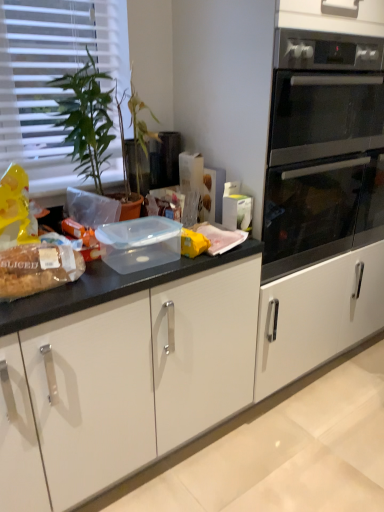
Question: Is translucent plastic bread at left not within green glossy plant at left?

Choices:
 (A) yes
 (B) no

Answer: (A)

Question: From a real-world perspective, is translucent plastic bread at left over green glossy plant at left?

Choices:
 (A) yes
 (B) no

Answer: (B)

Question: From the image's perspective, is translucent plastic bread at left above green glossy plant at left?

Choices:
 (A) yes
 (B) no

Answer: (B)

Question: Does translucent plastic bread at left have a greater width compared to green glossy plant at left?

Choices:
 (A) yes
 (B) no

Answer: (B)

Question: Is translucent plastic bread at left positioned behind green glossy plant at left?

Choices:
 (A) yes
 (B) no

Answer: (B)

Question: Is translucent plastic bread at left bigger than green glossy plant at left?

Choices:
 (A) yes
 (B) no

Answer: (B)

Question: Is translucent plastic bread at left located outside white plastic blinds at upper left?

Choices:
 (A) yes
 (B) no

Answer: (A)

Question: Is translucent plastic bread at left positioned far away from white plastic blinds at upper left?

Choices:
 (A) yes
 (B) no

Answer: (B)

Question: Considering the relative positions of translucent plastic bread at left and white plastic blinds at upper left in the image provided, is translucent plastic bread at left to the right of white plastic blinds at upper left from the viewer's perspective?

Choices:
 (A) no
 (B) yes

Answer: (B)

Question: From a real-world perspective, is translucent plastic bread at left physically below white plastic blinds at upper left?

Choices:
 (A) no
 (B) yes

Answer: (B)

Question: From the image's perspective, is translucent plastic bread at left beneath white plastic blinds at upper left?

Choices:
 (A) yes
 (B) no

Answer: (A)

Question: Considering the relative sizes of translucent plastic bread at left and white plastic blinds at upper left in the image provided, is translucent plastic bread at left thinner than white plastic blinds at upper left?

Choices:
 (A) yes
 (B) no

Answer: (B)

Question: Are white plastic blinds at upper left and stainless steel oven at right far apart?

Choices:
 (A) yes
 (B) no

Answer: (B)